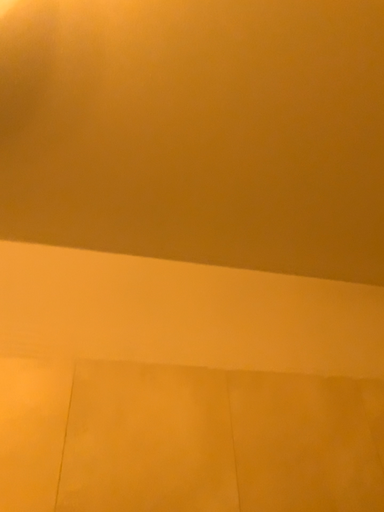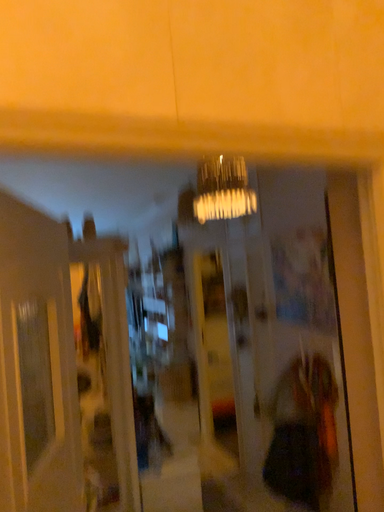
Question: How did the camera likely rotate when shooting the video?

Choices:
 (A) rotated upward
 (B) rotated downward

Answer: (B)